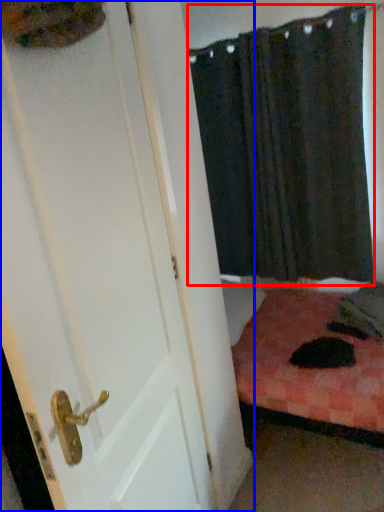
Question: Which object appears closest to the camera in this image, curtain (highlighted by a red box) or door (highlighted by a blue box)?

Choices:
 (A) curtain
 (B) door

Answer: (B)